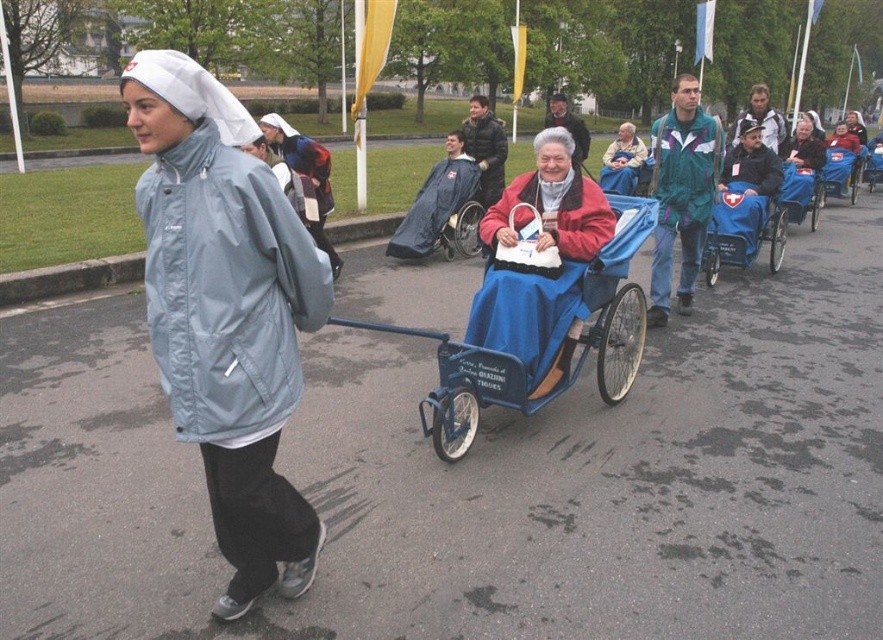
Question: Is blue fabric baby carriage at center positioned behind blue fabric coach at center?

Choices:
 (A) yes
 (B) no

Answer: (B)

Question: Is matte red coat at center closer to the viewer compared to light blue fabric wheelchair at center?

Choices:
 (A) yes
 (B) no

Answer: (A)

Question: Considering the real-world distances, which object is farthest from the light blue fabric jacket at left?

Choices:
 (A) matte red coat at center
 (B) light blue fabric wheelchair at center
 (C) blue fabric coach at center
 (D) blue fabric wheelchair at center

Answer: (B)

Question: Which point is closer to the camera?

Choices:
 (A) blue fabric coach at center
 (B) matte red coat at center
 (C) blue fabric wheelchair at center

Answer: (B)

Question: Does teal/white/green jacket at center come in front of blue fabric coach at center?

Choices:
 (A) yes
 (B) no

Answer: (B)

Question: Which is nearer to the matte red coat at center?

Choices:
 (A) light blue fabric jacket at left
 (B) blue fabric wheelchair at center

Answer: (A)